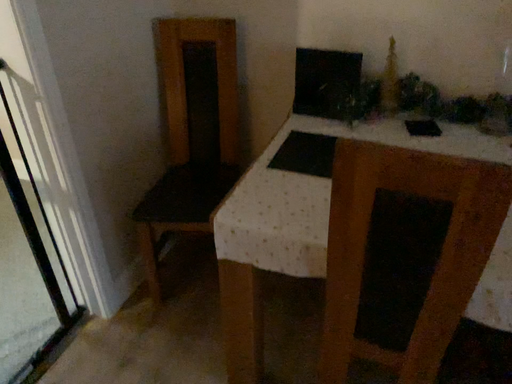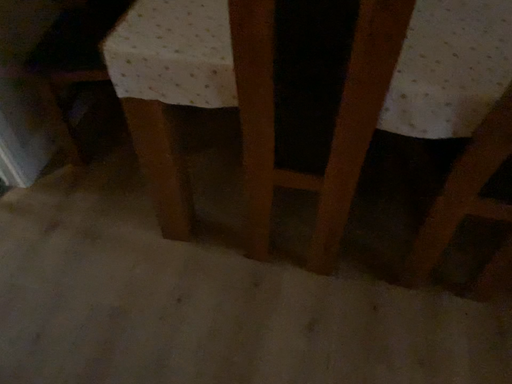
Question: How did the camera likely rotate when shooting the video?

Choices:
 (A) rotated right
 (B) rotated left

Answer: (A)